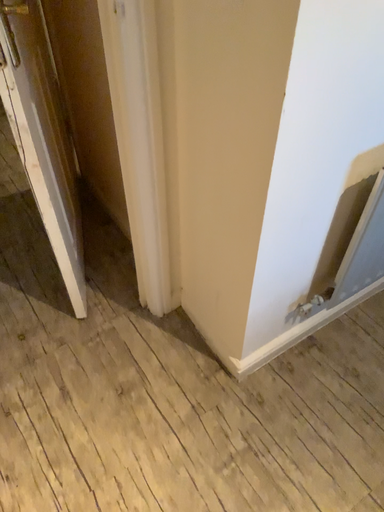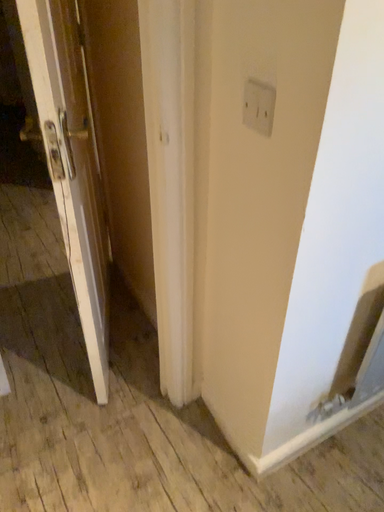
Question: How did the camera likely rotate when shooting the video?

Choices:
 (A) rotated upward
 (B) rotated downward

Answer: (A)